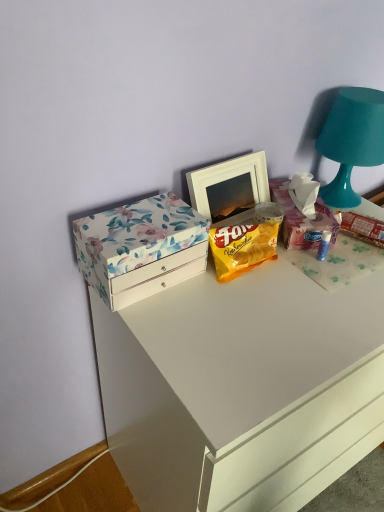
The height and width of the screenshot is (512, 384). Identify the location of vacant area to the right of floral paper box at left. (235, 300).